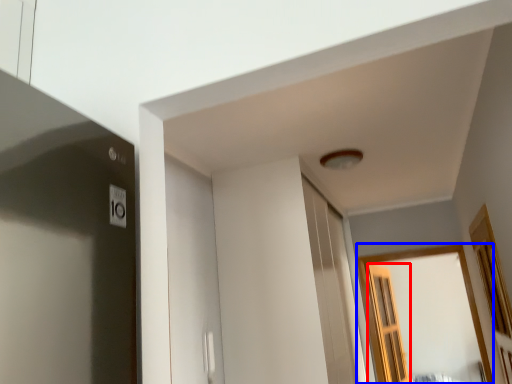
Question: Which object is further to the camera taking this photo, screen door (highlighted by a red box) or window (highlighted by a blue box)?

Choices:
 (A) screen door
 (B) window

Answer: (A)